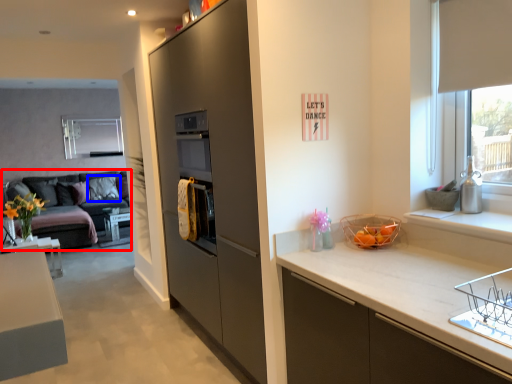
Question: Which object is closer to the camera taking this photo, studio couch (highlighted by a red box) or pillow (highlighted by a blue box)?

Choices:
 (A) studio couch
 (B) pillow

Answer: (A)